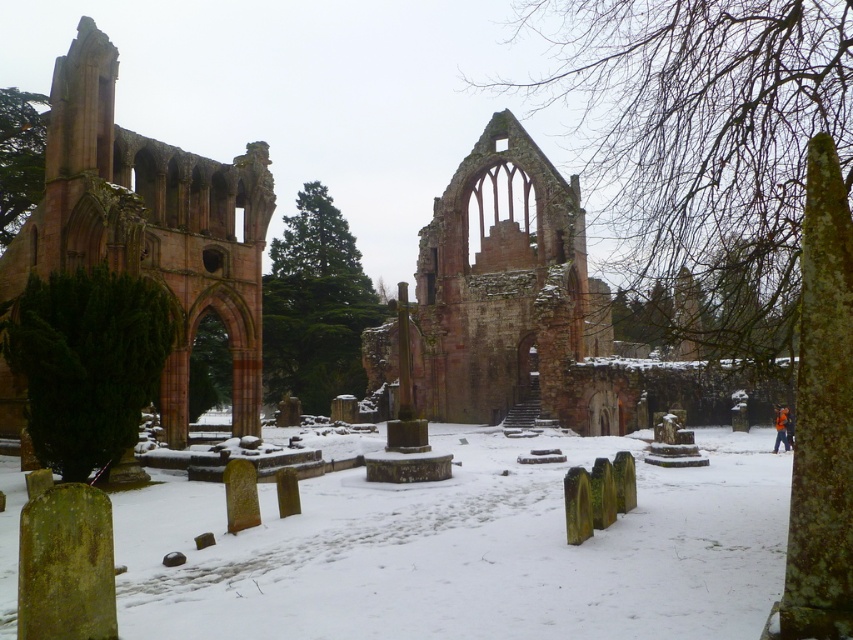
Question: Which point is farther to the camera?

Choices:
 (A) rustic stone ruins at center
 (B) rustic stone arch at left

Answer: (A)

Question: Is rustic stone arch at left above rustic stone ruins at center?

Choices:
 (A) no
 (B) yes

Answer: (B)

Question: Which object appears closest to the camera in this image?

Choices:
 (A) rustic stone arch at left
 (B) rustic stone ruins at center

Answer: (A)

Question: Does rustic stone arch at left have a greater width compared to rustic stone ruins at center?

Choices:
 (A) yes
 (B) no

Answer: (B)

Question: Can you confirm if rustic stone arch at left is positioned above rustic stone ruins at center?

Choices:
 (A) yes
 (B) no

Answer: (A)